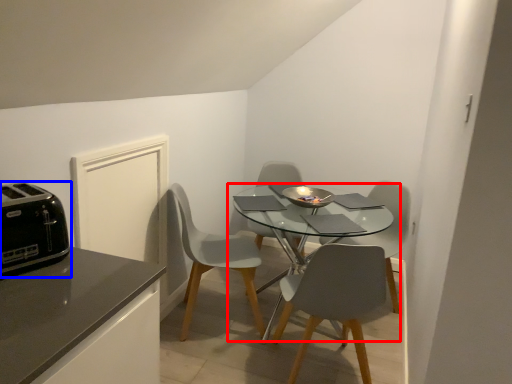
Question: Which point is closer to the camera, kitchen & dining room table (highlighted by a red box) or toaster (highlighted by a blue box)?

Choices:
 (A) kitchen & dining room table
 (B) toaster

Answer: (B)